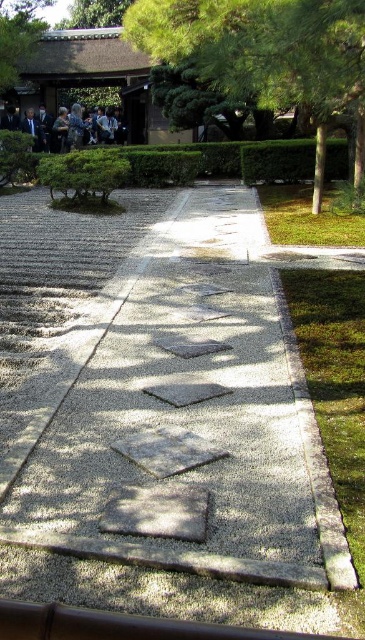
You are standing in the Japanese garden and want to reach the point marked as point [243,24]. If your walking speed is 3 feet per second, how many seconds will it take you to reach that point?

The point [243,24] is 24.78 feet away from the viewer. At a walking speed of 3 feet per second, it will take 24.78 divided by 3, which equals approximately 8.26 seconds to reach the point.

You are a visitor in the Japanese garden and want to walk from the dark gray suit at upper left to the green leafy tree at upper right. The gravel pathway is 1.2 meters wide. If you walk along the path, will you have enough space to walk comfortably without stepping on the hedges or the raked gravel?

The gravel pathway is 1.2 meters wide, which is a standard width for a walking path. Since the path is wide enough to accommodate a person walking comfortably, you can proceed along the path without needing to step onto the hedges or the raked gravel.

You are a visitor in the Japanese garden and want to take a photo of the green leafy tree at upper right and the dark gray suit at upper left. Which object should you point your camera towards first if you are standing at the gravel pathway?

The green leafy tree at upper right is below the dark gray suit at upper left, so you should point your camera towards the dark gray suit at upper left first as it is higher up in the scene.